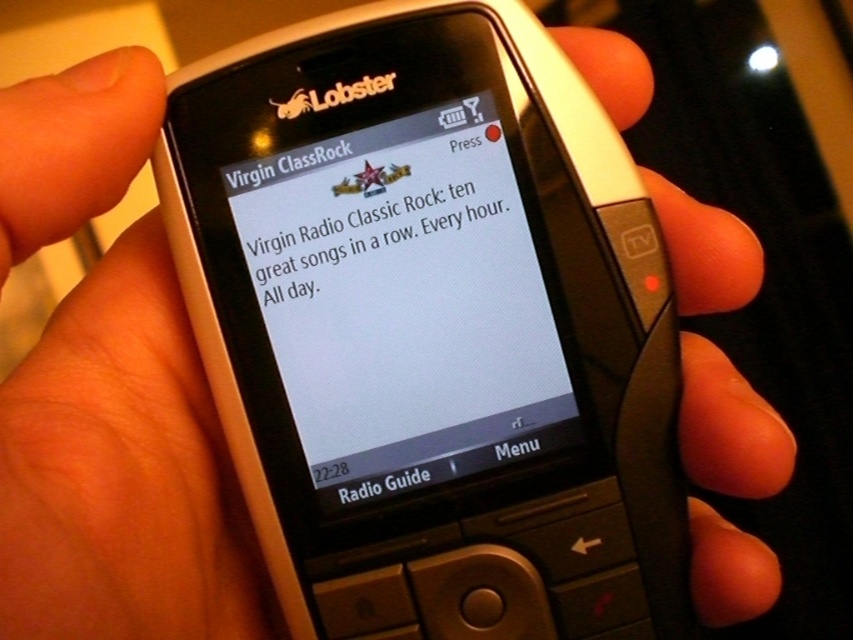
Can you confirm if matte black screen at center is bigger than white glossy text at center?

Correct, matte black screen at center is larger in size than white glossy text at center.

Can you confirm if matte black screen at center is shorter than white glossy text at center?

Incorrect, matte black screen at center's height does not fall short of white glossy text at center's.

You are a GUI agent. You are given a task and a screenshot of the screen. Output one action in this format:
    pyautogui.click(x=<x>, y=<y>)
    Task: Click on the matte black screen at center
    This screenshot has width=853, height=640.
    Given the screenshot: What is the action you would take?
    pyautogui.click(x=404, y=304)